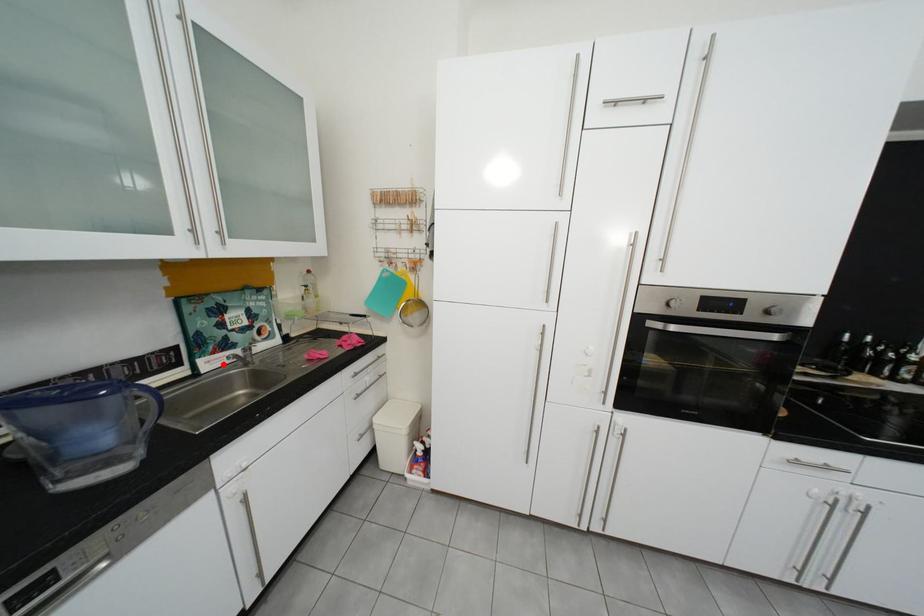
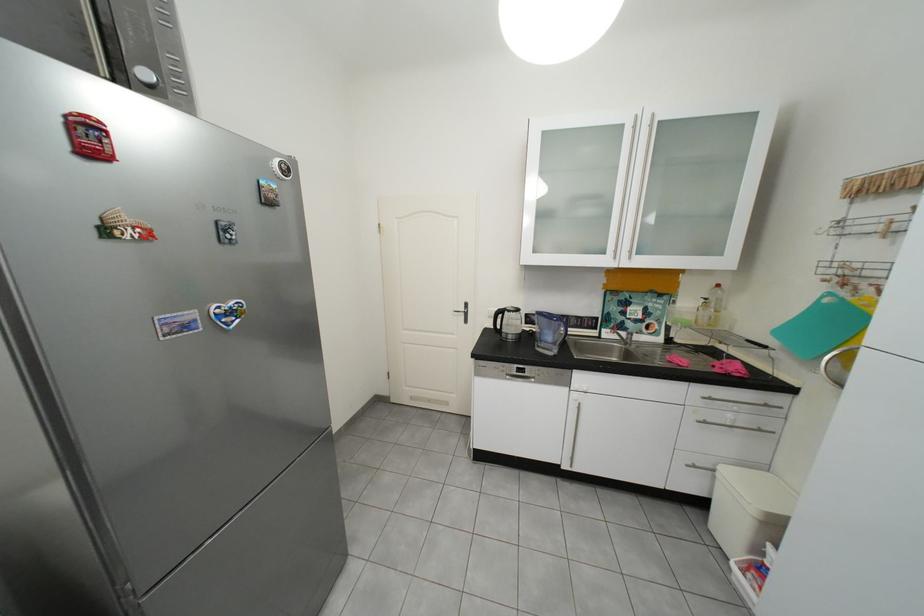
Question: I am providing you with two images of the same scene from different viewpoints. A red point is marked on the first image. Can you still see the location of the red point in image 2?

Choices:
 (A) Yes
 (B) No

Answer: (A)